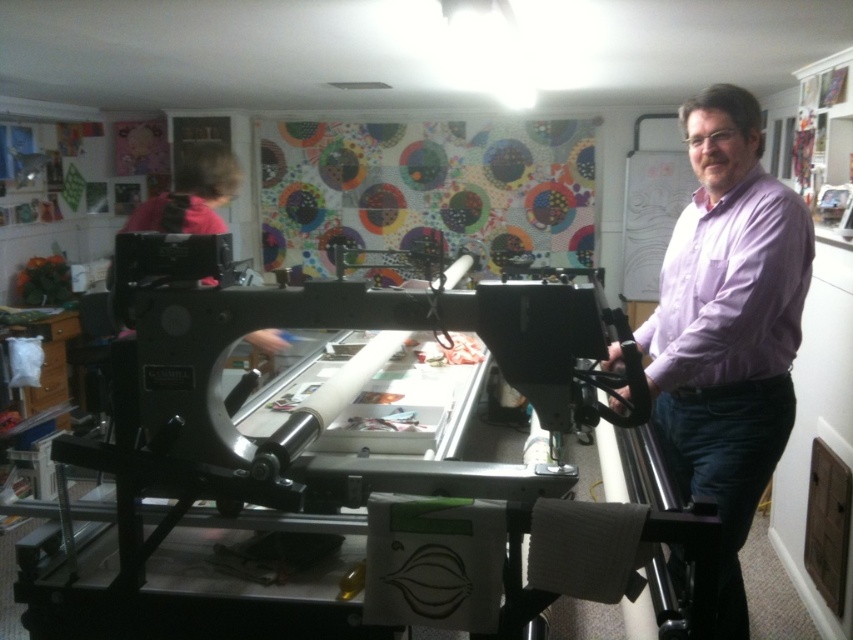
Question: Which object is the farthest from the metallic silver sewing machine at center?

Choices:
 (A) purple cotton shirt at center
 (B) purple cotton shirt at right

Answer: (B)

Question: Considering the real-world distances, which object is closest to the purple cotton shirt at center?

Choices:
 (A) purple cotton shirt at right
 (B) metallic silver sewing machine at center

Answer: (A)

Question: In this image, where is metallic silver sewing machine at center located relative to purple cotton shirt at center?

Choices:
 (A) above
 (B) below

Answer: (B)

Question: Considering the relative positions of purple cotton shirt at center and purple cotton shirt at right in the image provided, where is purple cotton shirt at center located with respect to purple cotton shirt at right?

Choices:
 (A) above
 (B) below

Answer: (B)

Question: Can you confirm if purple cotton shirt at center is wider than purple cotton shirt at right?

Choices:
 (A) no
 (B) yes

Answer: (B)

Question: Which of the following is the closest to the observer?

Choices:
 (A) purple cotton shirt at right
 (B) metallic silver sewing machine at center

Answer: (B)